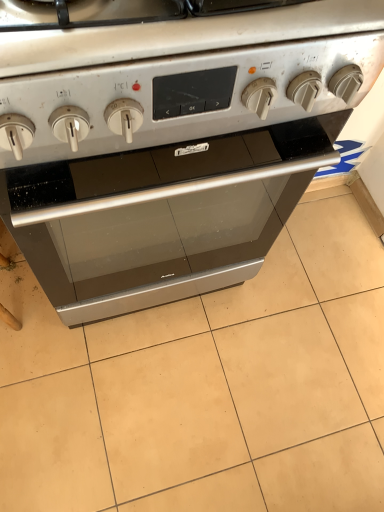
Question: Choose the correct answer: Is matte silver oven at center inside satin silver oven at center or outside it?

Choices:
 (A) inside
 (B) outside

Answer: (B)

Question: Looking at the image, does matte silver oven at center seem bigger or smaller compared to satin silver oven at center?

Choices:
 (A) small
 (B) big

Answer: (A)

Question: From the image's perspective, is matte silver oven at center above or below satin silver oven at center?

Choices:
 (A) below
 (B) above

Answer: (A)

Question: Considering the relative positions of satin silver oven at center and matte silver oven at center in the image provided, is satin silver oven at center to the left or to the right of matte silver oven at center?

Choices:
 (A) left
 (B) right

Answer: (A)

Question: From the image's perspective, relative to matte silver oven at center, is satin silver oven at center above or below?

Choices:
 (A) below
 (B) above

Answer: (B)

Question: Choose the correct answer: Is satin silver oven at center inside matte silver oven at center or outside it?

Choices:
 (A) outside
 (B) inside

Answer: (A)

Question: Is point (175, 180) positioned closer to the camera than point (185, 421)?

Choices:
 (A) farther
 (B) closer

Answer: (B)